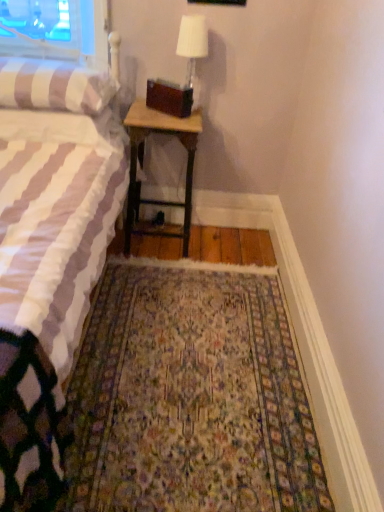
The height and width of the screenshot is (512, 384). I want to click on white striped fabric bed at left, so click(x=48, y=279).

This screenshot has width=384, height=512. What do you see at coordinates (190, 396) in the screenshot?
I see `floral carpet at center` at bounding box center [190, 396].

The image size is (384, 512). What are the coordinates of `wooden nightstand at center` in the screenshot? It's located at (142, 158).

Between white striped fabric bed at left and floral carpet at center, which one has more height?

white striped fabric bed at left.

Can we say white striped fabric bed at left lies outside floral carpet at center?

Yes, white striped fabric bed at left is located beyond the bounds of floral carpet at center.

Is white striped fabric bed at left thinner than floral carpet at center?

No, white striped fabric bed at left is not thinner than floral carpet at center.

Considering the relative positions of floral carpet at center and white fabric lampshade at upper center in the image provided, is floral carpet at center in front of white fabric lampshade at upper center?

Yes, floral carpet at center is closer to the viewer.

What's the angular difference between floral carpet at center and white fabric lampshade at upper center's facing directions?

The angular difference between floral carpet at center and white fabric lampshade at upper center is 2.4 degrees.

Does floral carpet at center appear on the left side of white fabric lampshade at upper center?

Correct, you'll find floral carpet at center to the left of white fabric lampshade at upper center.

From a real-world perspective, is floral carpet at center below white fabric lampshade at upper center?

Yes, from a real-world perspective, floral carpet at center is under white fabric lampshade at upper center.

Is white striped fabric bed at left directly adjacent to white fabric lampshade at upper center?

They are not placed beside each other.

Considering the points (83, 164) and (183, 23), which point is behind, point (83, 164) or point (183, 23)?

The point (183, 23) is farther from the camera.

Is white striped fabric bed at left positioned in front of white fabric lampshade at upper center?

Yes, it is in front of white fabric lampshade at upper center.

From a real-world perspective, who is located lower, wooden nightstand at center or white striped fabric bed at left?

wooden nightstand at center is physically lower.

How much distance is there between wooden nightstand at center and white striped fabric bed at left?

wooden nightstand at center is 24.20 inches away from white striped fabric bed at left.

Which object is more forward, wooden nightstand at center or white striped fabric bed at left?

white striped fabric bed at left is in front.

From the image's perspective, is wooden nightstand at center above or below white striped fabric bed at left?

Based on their image positions, wooden nightstand at center is located above white striped fabric bed at left.

Consider the image. How different are the orientations of wooden nightstand at center and white fabric lampshade at upper center in degrees?

The angular difference between wooden nightstand at center and white fabric lampshade at upper center is 2.64 degrees.

Is wooden nightstand at center smaller than white fabric lampshade at upper center?

No.

From a real-world perspective, is wooden nightstand at center located higher than white fabric lampshade at upper center?

No, from a real-world perspective, wooden nightstand at center is not on top of white fabric lampshade at upper center.

The image size is (384, 512). Find the location of `nightstand located below the white fabric lampshade at upper center (from the image's perspective)`. nightstand located below the white fabric lampshade at upper center (from the image's perspective) is located at coordinates (142, 158).

Which is more to the left, white fabric lampshade at upper center or floral carpet at center?

Positioned to the left is floral carpet at center.

From a real-world perspective, is white fabric lampshade at upper center below floral carpet at center?

No.

Which of these two, white fabric lampshade at upper center or floral carpet at center, is smaller?

white fabric lampshade at upper center.

From a real-world perspective, is striped fabric pillow at left positioned over wooden nightstand at center based on gravity?

Yes.

Choose the correct answer: Is striped fabric pillow at left inside wooden nightstand at center or outside it?

striped fabric pillow at left exists outside the volume of wooden nightstand at center.

Considering the sizes of objects striped fabric pillow at left and wooden nightstand at center in the image provided, who is taller, striped fabric pillow at left or wooden nightstand at center?

wooden nightstand at center is taller.

Looking at this image, considering the sizes of striped fabric pillow at left and wooden nightstand at center in the image, is striped fabric pillow at left wider or thinner than wooden nightstand at center?

In the image, striped fabric pillow at left appears to be wider than wooden nightstand at center.

Find the location of a particular element. bed that appears above the floral carpet at center (from the image's perspective) is located at coordinates (48, 279).

This screenshot has width=384, height=512. I want to click on mat in front of the white fabric lampshade at upper center, so click(x=190, y=396).

Consider the image. Based on their spatial positions, is floral carpet at center or white fabric lampshade at upper center closer to striped fabric pillow at left?

white fabric lampshade at upper center lies closer to striped fabric pillow at left than the other object.

Which object lies nearer to the anchor point white fabric lampshade at upper center, white striped fabric bed at left or striped fabric pillow at left?

striped fabric pillow at left is positioned closer to the anchor white fabric lampshade at upper center.

Looking at the image, which one is located closer to floral carpet at center, wooden nightstand at center or striped fabric pillow at left?

wooden nightstand at center is closer to floral carpet at center.

Estimate the real-world distances between objects in this image. Which object is closer to wooden nightstand at center, floral carpet at center or white striped fabric bed at left?

The object closer to wooden nightstand at center is white striped fabric bed at left.

Which object lies further to the anchor point white striped fabric bed at left, striped fabric pillow at left or white fabric lampshade at upper center?

white fabric lampshade at upper center is further to white striped fabric bed at left.

When comparing their distances from wooden nightstand at center, does white striped fabric bed at left or white fabric lampshade at upper center seem further?

The object further to wooden nightstand at center is white striped fabric bed at left.

Estimate the real-world distances between objects in this image. Which object is further from wooden nightstand at center, striped fabric pillow at left or white fabric lampshade at upper center?

The object further to wooden nightstand at center is white fabric lampshade at upper center.

Based on their spatial positions, is white striped fabric bed at left or striped fabric pillow at left closer to floral carpet at center?

white striped fabric bed at left is positioned closer to the anchor floral carpet at center.

At what (x,y) coordinates should I click in order to perform the action: click on nightstand between white fabric lampshade at upper center and floral carpet at center in the up-down direction. Please return your answer as a coordinate pair (x, y). Looking at the image, I should click on (142, 158).

Where is `bedside lamp between white striped fabric bed at left and wooden nightstand at center along the z-axis`? Image resolution: width=384 pixels, height=512 pixels. bedside lamp between white striped fabric bed at left and wooden nightstand at center along the z-axis is located at coordinates (192, 48).

I want to click on nightstand that lies between striped fabric pillow at left and floral carpet at center from top to bottom, so click(142, 158).

Locate an element on the screen. The height and width of the screenshot is (512, 384). mat positioned between white striped fabric bed at left and striped fabric pillow at left from near to far is located at coordinates (190, 396).